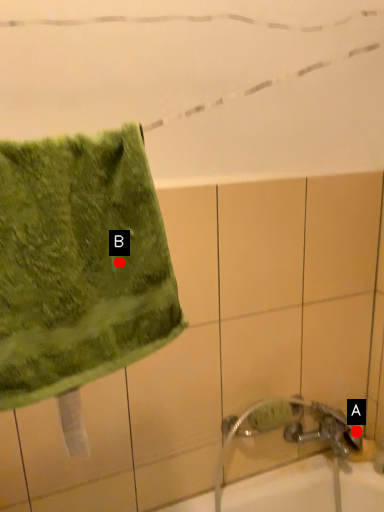
Question: Two points are circled on the image, labeled by A and B beside each circle. Which point is further to the camera?

Choices:
 (A) A is further
 (B) B is further

Answer: (A)